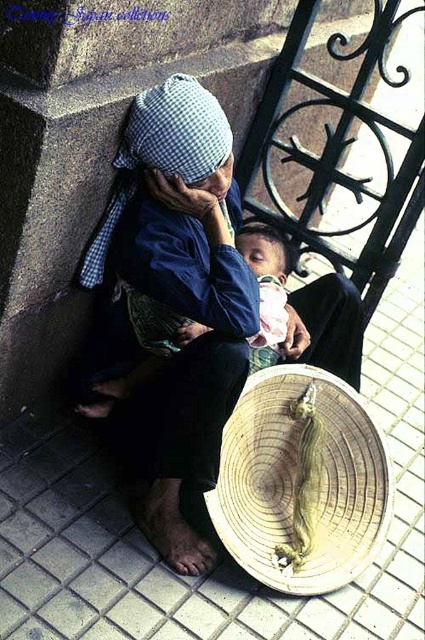
You are a photographer trying to capture the scene of the two individuals sitting on the white tile pavement at lower center and the woven straw basket at lower center. Based on their positions, which object is closer to the camera?

The white tile pavement at lower center is closer to the camera because it is above the woven straw basket at lower center, indicating it is positioned in front spatially.

You are a photographer trying to capture the scene from above. You notice the white tile pavement at lower center and the white checkered fabric at upper left. Which object is positioned higher from the ground?

The white checkered fabric at upper left is higher from the ground than the white tile pavement at lower center because the white tile pavement at lower center is located below it.